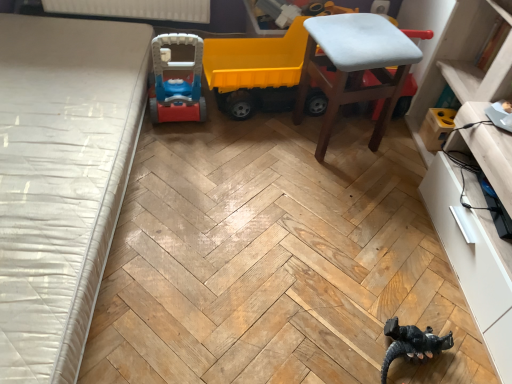
This screenshot has height=384, width=512. What are the coordinates of `free space to the left of white glossy dresser at lower right` in the screenshot? It's located at (356, 253).